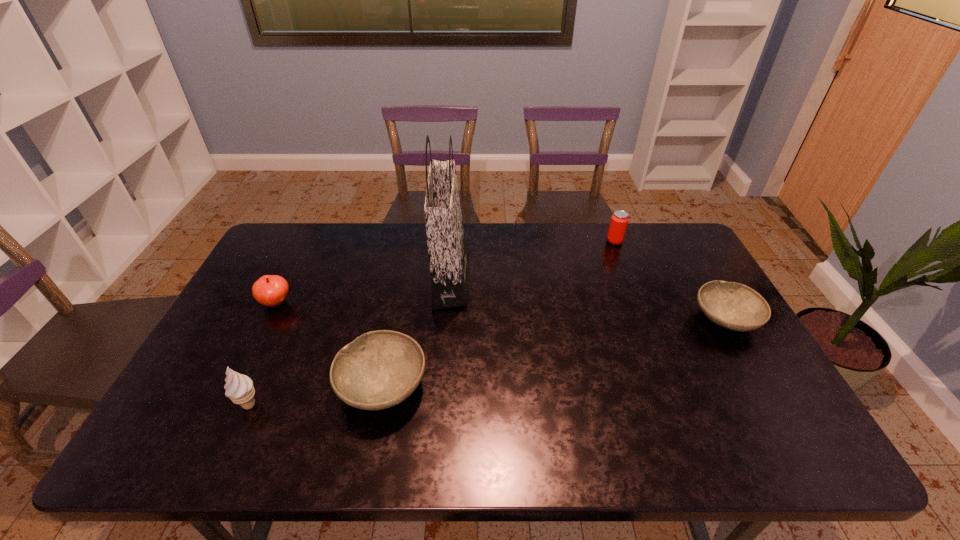
At what (x,y) coordinates should I click in order to perform the action: click on object that is the fourth closest one to the apple. Please return your answer as a coordinate pair (x, y). The image size is (960, 540). Looking at the image, I should click on (619, 220).

The image size is (960, 540). What are the coordinates of `free space that satisfies the following two spatial constraints: 1. on the front side of the apple; 2. on the right side of the rightmost object` in the screenshot? It's located at (268, 319).

The height and width of the screenshot is (540, 960). What are the coordinates of `vacant space that satisfies the following two spatial constraints: 1. on the front side of the farther bowl; 2. on the front-facing side of the second tallest object` in the screenshot? It's located at (775, 405).

Identify the location of vacant space that satisfies the following two spatial constraints: 1. on the front of the rightmost object with the design; 2. on the left side of the shopping bag. (447, 319).